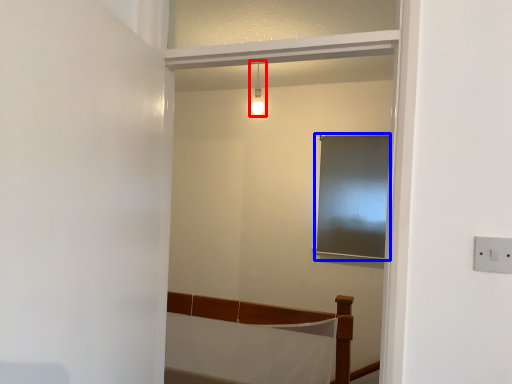
Question: Which object appears farthest to the camera in this image, light fixture (highlighted by a red box) or window (highlighted by a blue box)?

Choices:
 (A) light fixture
 (B) window

Answer: (B)